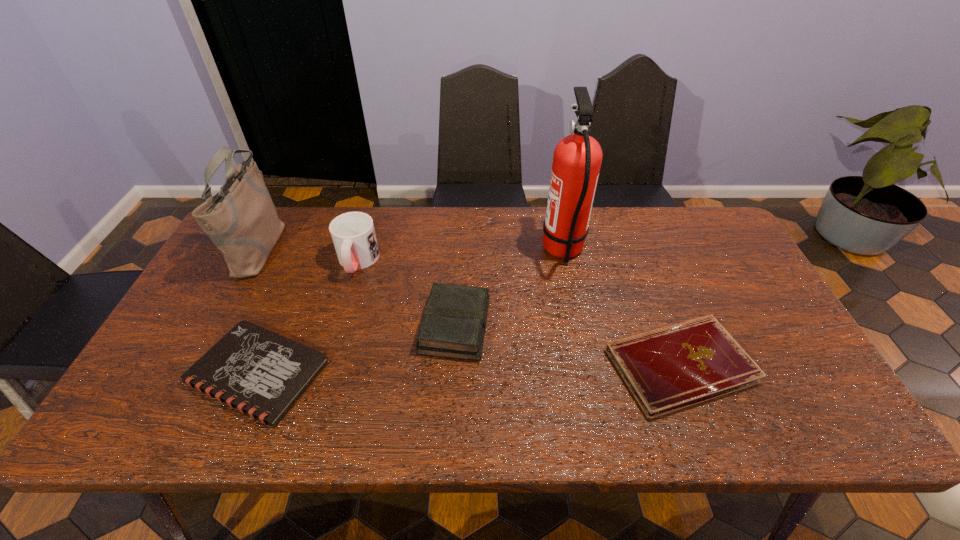
Locate an element on the screen. Image resolution: width=960 pixels, height=540 pixels. vacant space that satisfies the following two spatial constraints: 1. on the handle side of the tallest object; 2. on the side of the mug with the handle is located at coordinates (565, 261).

You are a GUI agent. You are given a task and a screenshot of the screen. Output one action in this format:
    pyautogui.click(x=<x>, y=<y>)
    Task: Click on the free space that satisfies the following two spatial constraints: 1. on the front-facing side of the fifth shortest object; 2. on the right side of the fourth tallest object
    
    Given the screenshot: What is the action you would take?
    pyautogui.click(x=219, y=326)

Locate an element on the screen. free space that satisfies the following two spatial constraints: 1. on the side of the fourth shortest object with the handle; 2. on the left side of the third object from right to left is located at coordinates (339, 326).

Locate an element on the screen. This screenshot has height=540, width=960. vacant space that satisfies the following two spatial constraints: 1. on the handle side of the fire extinguisher; 2. on the side of the fourth shortest object with the handle is located at coordinates (565, 261).